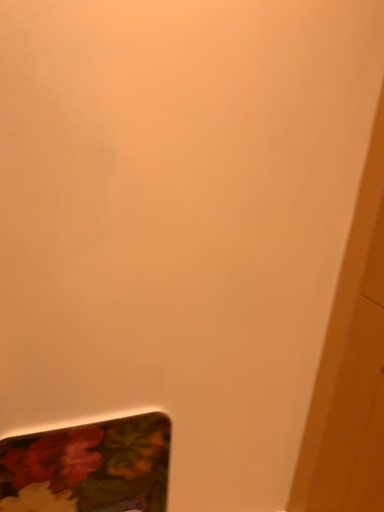
The image size is (384, 512). I want to click on floral fabric at bottom left, so click(x=89, y=467).

Describe the element at coordinates (89, 467) in the screenshot. This screenshot has height=512, width=384. I see `floral fabric at bottom left` at that location.

Locate an element on the screen. Image resolution: width=384 pixels, height=512 pixels. floral fabric at bottom left is located at coordinates click(x=89, y=467).